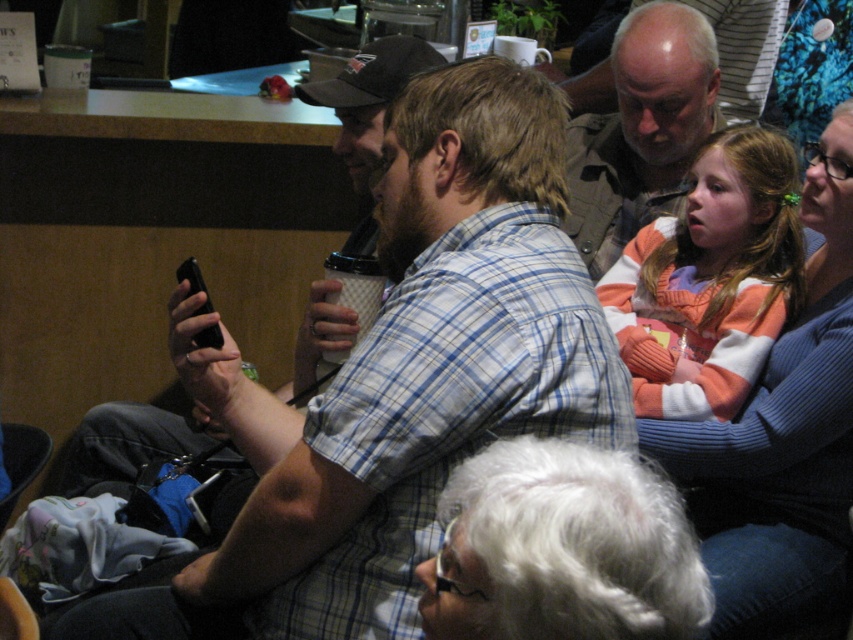
Describe the element at coordinates (399, 380) in the screenshot. I see `blue plaid shirt at center` at that location.

Is point (613, 356) in front of point (759, 275)?

Yes, it is in front of point (759, 275).

Describe the element at coordinates (399, 380) in the screenshot. I see `blue plaid shirt at center` at that location.

The width and height of the screenshot is (853, 640). In order to click on blue plaid shirt at center in this screenshot , I will do `click(399, 380)`.

Is striped sweater at upper right positioned behind matte khaki shirt at upper center?

No, striped sweater at upper right is in front of matte khaki shirt at upper center.

Can you confirm if striped sweater at upper right is taller than matte khaki shirt at upper center?

No, striped sweater at upper right is not taller than matte khaki shirt at upper center.

Where is `striped sweater at upper right`? striped sweater at upper right is located at coordinates (711, 280).

I want to click on striped sweater at upper right, so click(x=711, y=280).

Can you confirm if orange sweater at upper right is wider than striped sweater at upper right?

Yes, orange sweater at upper right is wider than striped sweater at upper right.

Who is positioned more to the right, orange sweater at upper right or striped sweater at upper right?

orange sweater at upper right is more to the right.

Identify the location of orange sweater at upper right. The width and height of the screenshot is (853, 640). (782, 436).

Identify the location of orange sweater at upper right. (782, 436).